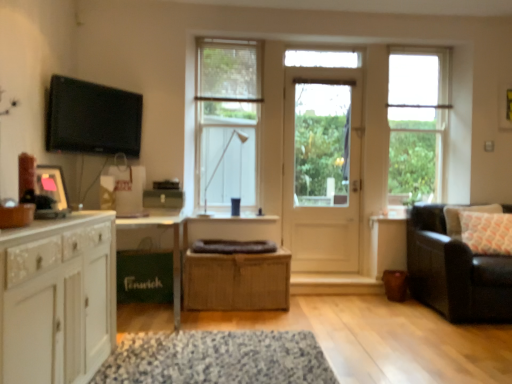
Question: Can we say clear glass window at upper right, placed as the first window when sorted from right to left, lies outside clear glass window at center, which is counted as the 1th window, starting from the left?

Choices:
 (A) no
 (B) yes

Answer: (B)

Question: From the image's perspective, does clear glass window at upper right, acting as the 2th window starting from the left, appear lower than clear glass window at center, which is counted as the 1th window, starting from the left?

Choices:
 (A) no
 (B) yes

Answer: (B)

Question: Would you say clear glass window at center, marked as the 2th window in a right-to-left arrangement, is part of clear glass window at upper right, acting as the 2th window starting from the left,'s contents?

Choices:
 (A) no
 (B) yes

Answer: (A)

Question: Can you confirm if clear glass window at upper right, acting as the 2th window starting from the left, is bigger than clear glass window at center, marked as the 2th window in a right-to-left arrangement?

Choices:
 (A) no
 (B) yes

Answer: (A)

Question: Is clear glass window at upper right, placed as the first window when sorted from right to left, with clear glass window at center, which is counted as the 1th window, starting from the left?

Choices:
 (A) yes
 (B) no

Answer: (B)

Question: Is clear glass window at upper right, acting as the 2th window starting from the left, at the right side of clear glass window at center, marked as the 2th window in a right-to-left arrangement?

Choices:
 (A) yes
 (B) no

Answer: (A)

Question: Is matte blue cup at center wider than clear glass window at center, which is counted as the 1th window, starting from the left?

Choices:
 (A) no
 (B) yes

Answer: (A)

Question: Is matte blue cup at center far away from clear glass window at center, marked as the 2th window in a right-to-left arrangement?

Choices:
 (A) no
 (B) yes

Answer: (A)

Question: Can clear glass window at center, marked as the 2th window in a right-to-left arrangement, be found inside matte blue cup at center?

Choices:
 (A) yes
 (B) no

Answer: (B)

Question: Is the position of matte blue cup at center less distant than that of clear glass window at center, marked as the 2th window in a right-to-left arrangement?

Choices:
 (A) no
 (B) yes

Answer: (B)

Question: Can you confirm if matte blue cup at center is shorter than clear glass window at center, marked as the 2th window in a right-to-left arrangement?

Choices:
 (A) yes
 (B) no

Answer: (A)

Question: Is the surface of matte blue cup at center in direct contact with clear glass window at center, marked as the 2th window in a right-to-left arrangement?

Choices:
 (A) yes
 (B) no

Answer: (B)

Question: From the image's perspective, is white wooden door at center on top of leather couch at right?

Choices:
 (A) no
 (B) yes

Answer: (B)